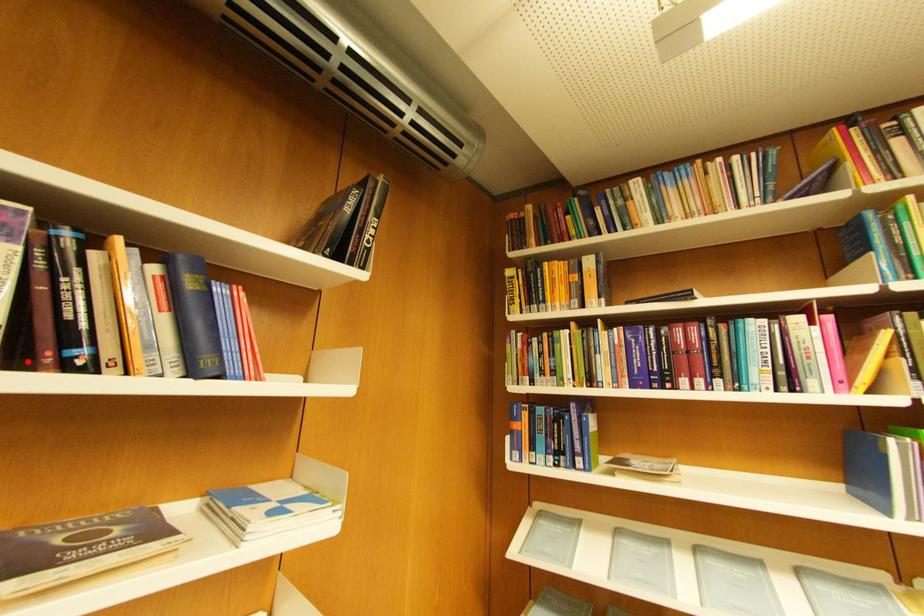
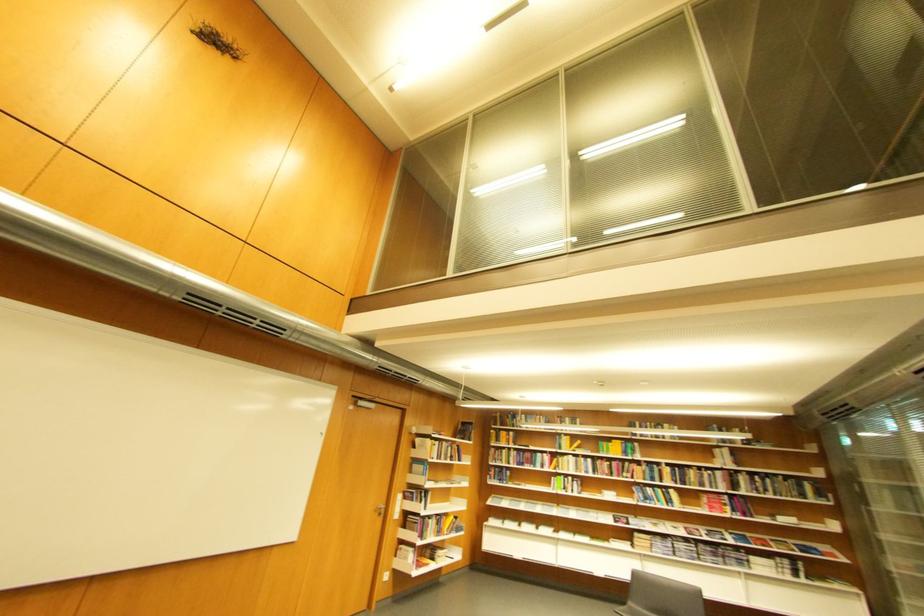
Question: A red point is marked in image1. In image2, is the corresponding 3D point closer to the camera or farther? Reply with the corresponding letter.

Choices:
 (A) The corresponding 3D point is closer.
 (B) The corresponding 3D point is farther.

Answer: (B)